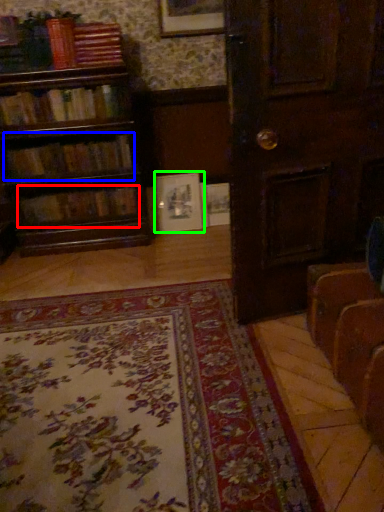
Question: Considering the real-world distances, which object is closest to book (highlighted by a red box)? book (highlighted by a blue box) or picture frame (highlighted by a green box).

Choices:
 (A) book
 (B) picture frame

Answer: (A)